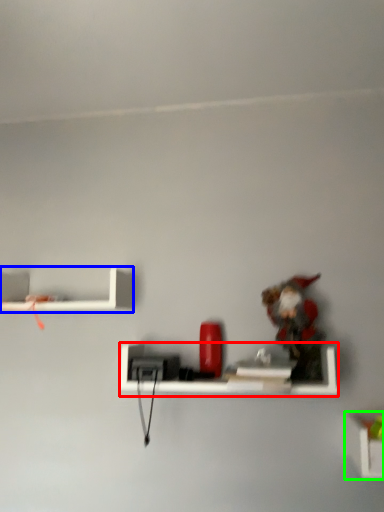
Question: Which is farther away from shelf (highlighted by a red box)? shelf (highlighted by a blue box) or shelf (highlighted by a green box)?

Choices:
 (A) shelf
 (B) shelf

Answer: (A)